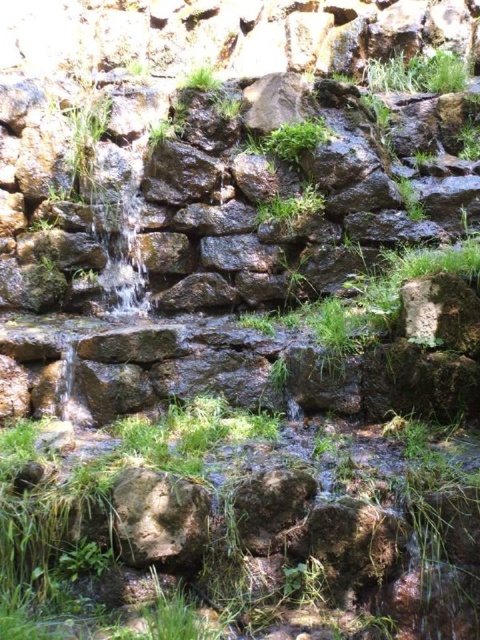
Question: Which object is positioned farthest from the rough textured rock at center?

Choices:
 (A) green grassy at lower center
 (B) green leafy grass at center

Answer: (B)

Question: Among these points, which one is farthest from the camera?

Choices:
 (A) coord(244,628)
 (B) coord(133,564)
 (C) coord(320,204)

Answer: (C)

Question: Can you confirm if rough textured rock at center is positioned below green leafy grass at center?

Choices:
 (A) yes
 (B) no

Answer: (A)

Question: Can you confirm if green grassy at lower center is positioned above rough textured rock at center?

Choices:
 (A) yes
 (B) no

Answer: (A)

Question: Does green grassy at lower center appear on the right side of green leafy grass at center?

Choices:
 (A) no
 (B) yes

Answer: (A)

Question: Which of the following is the closest to the observer?

Choices:
 (A) (168, 532)
 (B) (272, 212)
 (C) (194, 426)

Answer: (A)